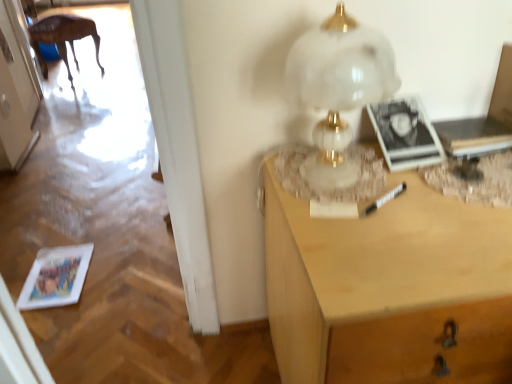
This screenshot has width=512, height=384. What do you see at coordinates (17, 88) in the screenshot?
I see `white glossy door at upper left` at bounding box center [17, 88].

Identify the location of white glossy door at upper left. (17, 88).

The width and height of the screenshot is (512, 384). What do you see at coordinates (63, 37) in the screenshot?
I see `wooden table at left` at bounding box center [63, 37].

Locate an element on the screen. The image size is (512, 384). wooden table at left is located at coordinates (63, 37).

In order to face light wood desk at right, should I rotate leftwards or rightwards?

Turn right approximately 24.234 degrees to face it.

Describe the element at coordinates (56, 277) in the screenshot. I see `matte paper magazine at lower left` at that location.

Find the location of a particular element. The image size is (512, 384). white glossy door at upper left is located at coordinates (17, 88).

Based on the photo, is white marble table lamp at upper right oriented away from light wood desk at right?

No, light wood desk at right is not at the back of white marble table lamp at upper right.

Consider the image. Is white marble table lamp at upper right far away from light wood desk at right?

white marble table lamp at upper right is near light wood desk at right, not far away.

From the image's perspective, is white marble table lamp at upper right on top of light wood desk at right?

Yes, from the image's perspective, white marble table lamp at upper right is over light wood desk at right.

From the image's perspective, would you say white glossy door at upper left is shown under matte paper magazine at lower left?

Incorrect, from the image's perspective, white glossy door at upper left is higher than matte paper magazine at lower left.

Does white glossy door at upper left appear on the left side of matte paper magazine at lower left?

Yes, white glossy door at upper left is to the left of matte paper magazine at lower left.

From the picture: Is matte paper magazine at lower left a part of white glossy door at upper left?

No.

Find the location of a particular element. The width and height of the screenshot is (512, 384). magazine located on the right of white glossy door at upper left is located at coordinates (56, 277).

Where is `door below the wooden table at left (from the image's perspective)`? door below the wooden table at left (from the image's perspective) is located at coordinates (17, 88).

Is white glossy door at upper left taller or shorter than wooden table at left?

In the image, white glossy door at upper left appears to be taller than wooden table at left.

Considering the relative sizes of white glossy door at upper left and wooden table at left in the image provided, is white glossy door at upper left thinner than wooden table at left?

Yes.

Between white glossy door at upper left and wooden table at left, which one is positioned in front?

white glossy door at upper left.

Is matte paper magazine at lower left closer to camera compared to light wood desk at right?

No, the depth of matte paper magazine at lower left is greater than that of light wood desk at right.

Are matte paper magazine at lower left and light wood desk at right far apart?

Indeed, matte paper magazine at lower left is not near light wood desk at right.

Considering the sizes of objects matte paper magazine at lower left and light wood desk at right in the image provided, who is smaller, matte paper magazine at lower left or light wood desk at right?

matte paper magazine at lower left.

Is light wood desk at right further to the viewer compared to white glossy door at upper left?

No, the depth of light wood desk at right is less than that of white glossy door at upper left.

Is light wood desk at right oriented away from white glossy door at upper left?

No, light wood desk at right is not facing away from white glossy door at upper left.

Does light wood desk at right have a greater height compared to white glossy door at upper left?

→ In fact, light wood desk at right may be shorter than white glossy door at upper left.

Considering the sizes of objects light wood desk at right and white glossy door at upper left in the image provided, who is thinner, light wood desk at right or white glossy door at upper left?

white glossy door at upper left is thinner.

Are wooden table at left and white marble table lamp at upper right located far from each other?

wooden table at left is positioned a significant distance from white marble table lamp at upper right.

Does wooden table at left contain white marble table lamp at upper right?

No.

Considering the positions of point (74, 25) and point (305, 164), is point (74, 25) closer or farther from the camera than point (305, 164)?

Point (74, 25) is farther from the camera than point (305, 164).

Considering the positions of objects light wood desk at right and white marble table lamp at upper right in the image provided, who is more to the right, light wood desk at right or white marble table lamp at upper right?

light wood desk at right is more to the right.

Is light wood desk at right not within white marble table lamp at upper right?

Absolutely, light wood desk at right is external to white marble table lamp at upper right.

In order to click on desk that appears below the white marble table lamp at upper right (from a real-world perspective) in this screenshot , I will do `click(389, 289)`.

Which is in front, point (315, 283) or point (345, 134)?

The point (315, 283) is in front.

Identify the location of desk below the white marble table lamp at upper right (from a real-world perspective). The width and height of the screenshot is (512, 384). (389, 289).

Where is `door positioned vertically above the matte paper magazine at lower left (from a real-world perspective)`? door positioned vertically above the matte paper magazine at lower left (from a real-world perspective) is located at coordinates (17, 88).

When comparing their distances from wooden table at left, does white marble table lamp at upper right or matte paper magazine at lower left seem further?

Based on the image, white marble table lamp at upper right appears to be further to wooden table at left.

From the image, which object appears to be farther from white glossy door at upper left, light wood desk at right or white marble table lamp at upper right?

Based on the image, light wood desk at right appears to be further to white glossy door at upper left.

Looking at this image, when comparing their distances from white marble table lamp at upper right, does matte paper magazine at lower left or light wood desk at right seem closer?

light wood desk at right is closer to white marble table lamp at upper right.

Looking at the image, which one is located further to light wood desk at right, wooden table at left or matte paper magazine at lower left?

Among the two, wooden table at left is located further to light wood desk at right.

Which object lies further to the anchor point white glossy door at upper left, light wood desk at right or wooden table at left?

light wood desk at right lies further to white glossy door at upper left than the other object.

In the scene shown: Which object lies further to the anchor point white glossy door at upper left, wooden table at left or light wood desk at right?

Among the two, light wood desk at right is located further to white glossy door at upper left.

Considering their positions, is white glossy door at upper left positioned further to matte paper magazine at lower left than light wood desk at right?

light wood desk at right is further to matte paper magazine at lower left.

Which object lies nearer to the anchor point white glossy door at upper left, matte paper magazine at lower left or white marble table lamp at upper right?

matte paper magazine at lower left is closer to white glossy door at upper left.

The image size is (512, 384). I want to click on magazine between white marble table lamp at upper right and wooden table at left from front to back, so click(x=56, y=277).

In order to click on magazine between light wood desk at right and wooden table at left along the z-axis in this screenshot , I will do `click(56, 277)`.

The height and width of the screenshot is (384, 512). Identify the location of magazine between white glossy door at upper left and light wood desk at right from left to right. (56, 277).

Find the location of a particular element. table lamp between light wood desk at right and wooden table at left along the z-axis is located at coordinates (338, 89).